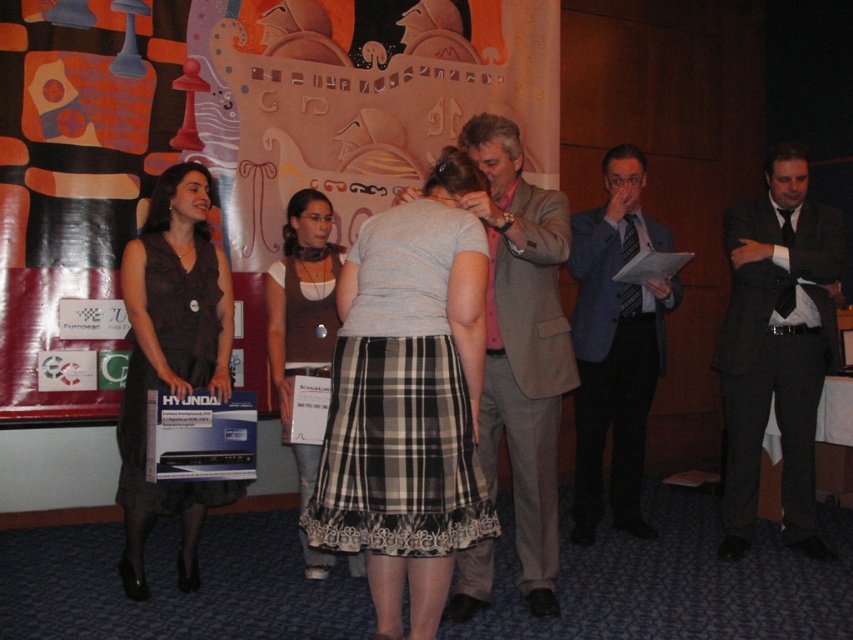
Who is positioned more to the left, dark gray suit at right or plaid fabric skirt at center?

plaid fabric skirt at center is more to the left.

Is dark gray suit at right shorter than plaid fabric skirt at center?

In fact, dark gray suit at right may be taller than plaid fabric skirt at center.

This screenshot has height=640, width=853. Find the location of `dark gray suit at right`. dark gray suit at right is located at coordinates (776, 346).

Identify the location of dark gray suit at right. (776, 346).

Does plastic box at center have a larger size compared to blue suit at center?

Yes, plastic box at center is bigger than blue suit at center.

You are a GUI agent. You are given a task and a screenshot of the screen. Output one action in this format:
    pyautogui.click(x=<x>, y=<y>)
    Task: Click on the plastic box at center
    The image size is (853, 640).
    Given the screenshot: What is the action you would take?
    pyautogui.click(x=229, y=138)

Where is `gray cotton shirt at center`? The image size is (853, 640). gray cotton shirt at center is located at coordinates (408, 401).

Is point (437, 604) in front of point (122, 426)?

Yes, point (437, 604) is closer to viewer.

You are a GUI agent. You are given a task and a screenshot of the screen. Output one action in this format:
    pyautogui.click(x=<x>, y=<y>)
    Task: Click on the gray cotton shirt at center
    
    Given the screenshot: What is the action you would take?
    pyautogui.click(x=408, y=401)